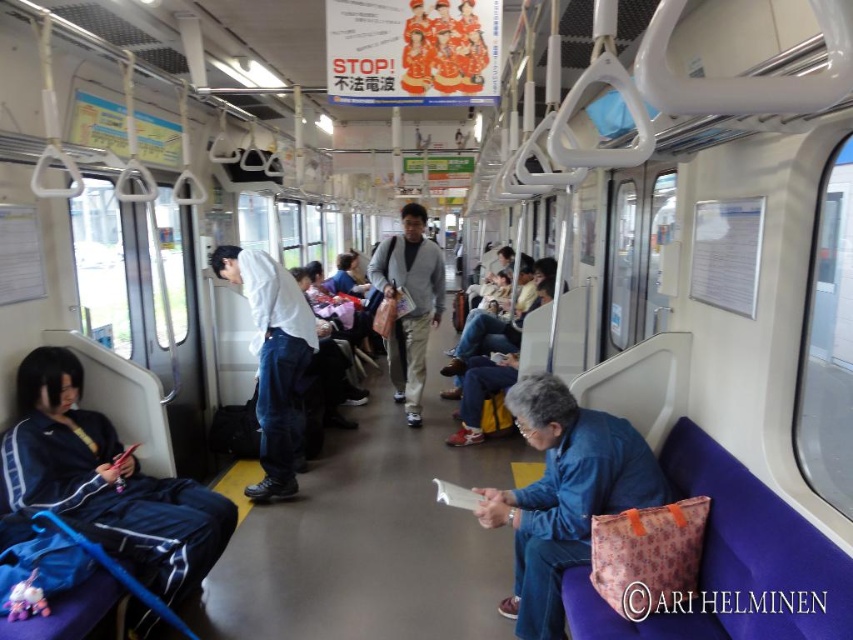
From the picture: You are a passenger on the train and want to put your blue fabric bag at lower right next to your matte gray sweater at center. Can you place it to the left or right of the sweater?

The blue fabric bag at lower right is already to the right of matte gray sweater at center, so you can place it to the right of the sweater.

You are a passenger on the train and want to pick up the blue fabric bag at lower right and the denim pants at center. Which item is easier to reach without moving from your current position?

The blue fabric bag at lower right is closer to the viewer than the denim pants at center, so it is easier to reach without moving.

You are a passenger on a train and you have a blue fabric bag at lower right and denim pants at center. Which item is located more to the right side of the train carriage?

The blue fabric bag at lower right is positioned on the right side of denim pants at center, so it is more to the right.